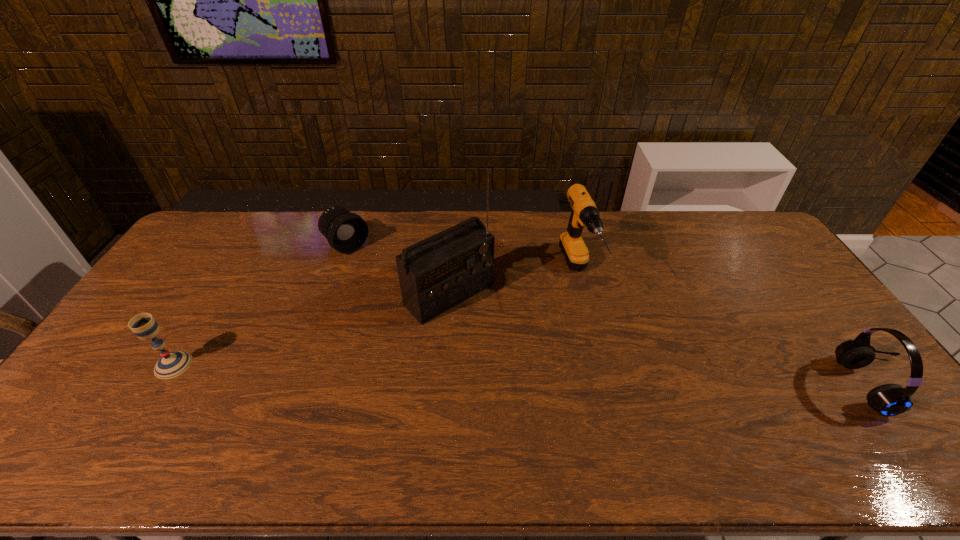
Find the location of a particular element. free space on the desktop that is between the leftmost object and the headset and is positioned on the front panel of the radio receiver is located at coordinates (534, 375).

Where is `vacant spot on the desktop that is between the chalice and the rightmost object and is positioned at the front element of the second object from left to right`? vacant spot on the desktop that is between the chalice and the rightmost object and is positioned at the front element of the second object from left to right is located at coordinates (496, 374).

Identify the location of free space on the desktop that is between the chalice and the headset and is positioned at the tip of the second object from right to left. This screenshot has height=540, width=960. (624, 378).